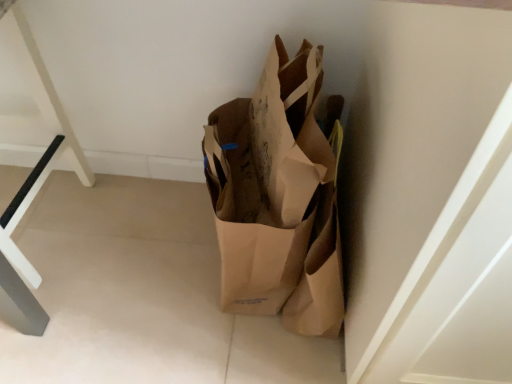
Question: From the image's perspective, is brown paper bag at center located above white plastic table at left?

Choices:
 (A) no
 (B) yes

Answer: (A)

Question: Is brown paper bag at center in contact with white plastic table at left?

Choices:
 (A) no
 (B) yes

Answer: (A)

Question: Is brown paper bag at center facing towards white plastic table at left?

Choices:
 (A) yes
 (B) no

Answer: (B)

Question: Is brown paper bag at center turned away from white plastic table at left?

Choices:
 (A) no
 (B) yes

Answer: (A)

Question: Is brown paper bag at center positioned in front of white plastic table at left?

Choices:
 (A) yes
 (B) no

Answer: (A)

Question: Can you confirm if brown paper bag at center is thinner than white plastic table at left?

Choices:
 (A) yes
 (B) no

Answer: (B)

Question: Is white plastic table at left completely or partially outside of brown paper bag at center?

Choices:
 (A) yes
 (B) no

Answer: (A)

Question: Can you confirm if white plastic table at left is taller than brown paper bag at center?

Choices:
 (A) no
 (B) yes

Answer: (A)

Question: Does white plastic table at left appear on the right side of brown paper bag at center?

Choices:
 (A) yes
 (B) no

Answer: (B)

Question: Could brown paper bag at center be considered to be inside white plastic table at left?

Choices:
 (A) yes
 (B) no

Answer: (B)

Question: Is white plastic table at left turned away from brown paper bag at center?

Choices:
 (A) yes
 (B) no

Answer: (B)

Question: Is white plastic table at left in front of brown paper bag at center?

Choices:
 (A) no
 (B) yes

Answer: (A)

Question: In the image, is white plastic table at left positioned in front of or behind brown paper bag at center?

Choices:
 (A) behind
 (B) front

Answer: (A)